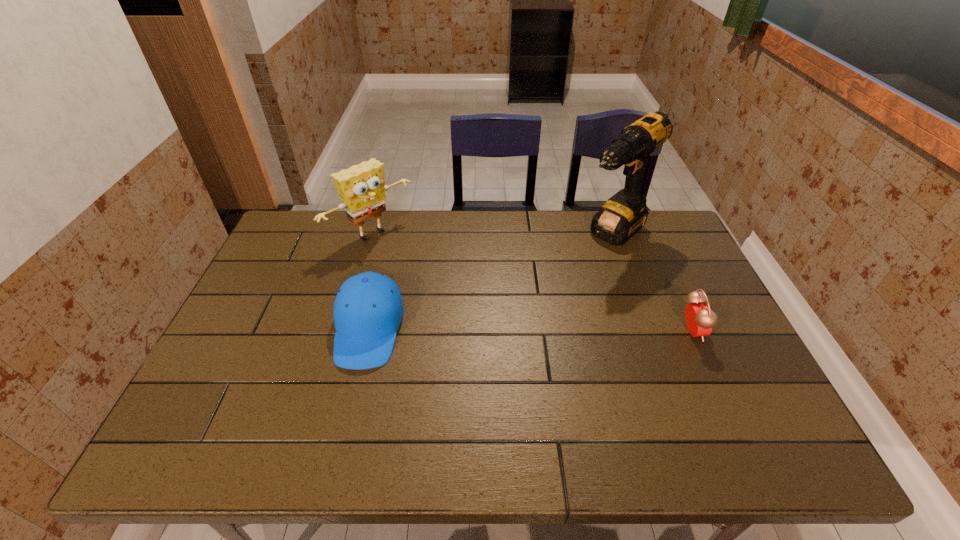
The image size is (960, 540). In order to click on cap in this screenshot , I will do `click(368, 310)`.

The height and width of the screenshot is (540, 960). In order to click on alarm clock in this screenshot , I will do `click(700, 320)`.

Where is `the third shortest object`? The height and width of the screenshot is (540, 960). the third shortest object is located at coordinates (362, 188).

You are a GUI agent. You are given a task and a screenshot of the screen. Output one action in this format:
    pyautogui.click(x=<x>, y=<y>)
    Task: Click on the drill
    The height and width of the screenshot is (540, 960).
    Given the screenshot: What is the action you would take?
    pyautogui.click(x=623, y=215)

I want to click on free point located on the front-facing side of the cap, so click(x=348, y=417).

The height and width of the screenshot is (540, 960). I want to click on vacant space situated 0.060m on the clock face of the alarm clock, so click(x=724, y=331).

The width and height of the screenshot is (960, 540). In order to click on free region located 0.350m on the face of the sponge in this screenshot , I will do `click(468, 311)`.

Identify the location of vacant space located on the face of the sponge. (424, 275).

Where is `blank space located on the face of the sponge`? blank space located on the face of the sponge is located at coordinates (416, 269).

In order to click on blank space located at the tip of the drill in this screenshot , I will do `click(525, 318)`.